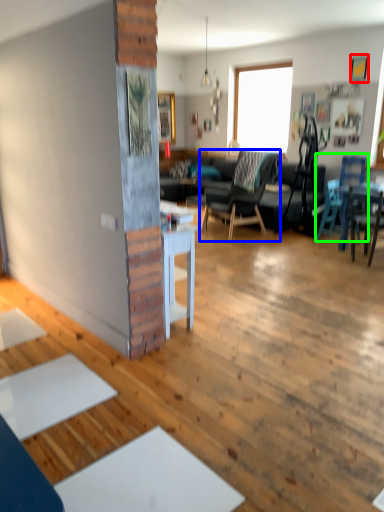
Question: Which object is positioned closest to picture frame (highlighted by a red box)? Select from chair (highlighted by a blue box) and chair (highlighted by a green box).

Choices:
 (A) chair
 (B) chair

Answer: (B)